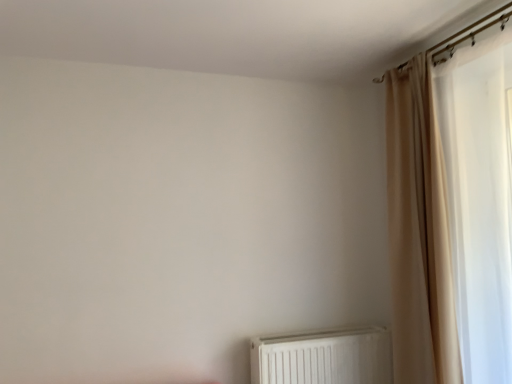
Question: Does point (303, 382) appear closer or farther from the camera than point (398, 198)?

Choices:
 (A) closer
 (B) farther

Answer: (B)

Question: Looking at their shapes, would you say white plastic radiator at lower center is wider or thinner than beige fabric curtain at right?

Choices:
 (A) thin
 (B) wide

Answer: (A)

Question: Considering the positions of white plastic radiator at lower center and beige fabric curtain at right in the image, is white plastic radiator at lower center taller or shorter than beige fabric curtain at right?

Choices:
 (A) short
 (B) tall

Answer: (A)

Question: From a real-world perspective, is beige fabric curtain at right positioned above or below white plastic radiator at lower center?

Choices:
 (A) below
 (B) above

Answer: (B)

Question: Considering their positions, is beige fabric curtain at right located in front of or behind white plastic radiator at lower center?

Choices:
 (A) front
 (B) behind

Answer: (A)

Question: Would you say beige fabric curtain at right is to the left or to the right of white plastic radiator at lower center in the picture?

Choices:
 (A) right
 (B) left

Answer: (A)

Question: Is beige fabric curtain at right wider or thinner than white plastic radiator at lower center?

Choices:
 (A) wide
 (B) thin

Answer: (A)